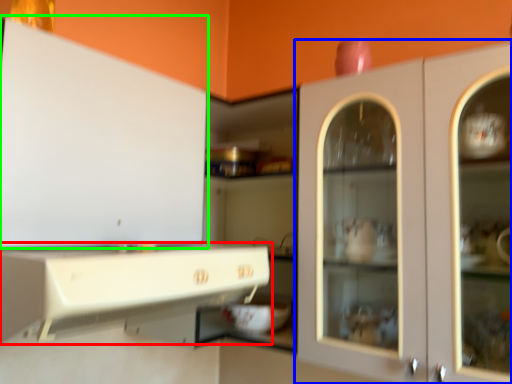
Question: Which object is positioned farthest from cabinetry (highlighted by a red box)? Select from cabinetry (highlighted by a blue box) and cabinetry (highlighted by a green box).

Choices:
 (A) cabinetry
 (B) cabinetry

Answer: (A)